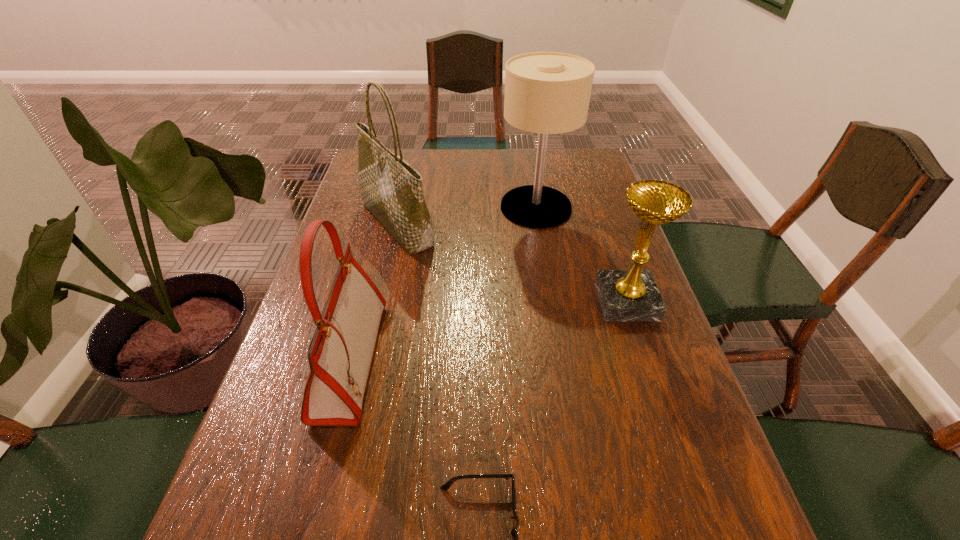
You are a GUI agent. You are given a task and a screenshot of the screen. Output one action in this format:
    pyautogui.click(x=<x>, y=<y>)
    Task: Click on the vacant space that is in between the award and the fourth object from left to right
    The height and width of the screenshot is (540, 960).
    Given the screenshot: What is the action you would take?
    pyautogui.click(x=581, y=254)

Find the location of a particular element. The height and width of the screenshot is (540, 960). empty space that is in between the rightmost object and the shopping bag is located at coordinates (512, 264).

Where is `vacant space in between the table lamp and the second shortest object`? The width and height of the screenshot is (960, 540). vacant space in between the table lamp and the second shortest object is located at coordinates (581, 254).

I want to click on empty space that is in between the award and the second object from right to left, so (x=581, y=254).

At what (x,y) coordinates should I click in order to perform the action: click on vacant region between the handbag and the fourth object from left to right. Please return your answer as a coordinate pair (x, y). Looking at the image, I should click on (444, 284).

Where is `vacant space that is in between the fourth object from left to right and the handbag`? The height and width of the screenshot is (540, 960). vacant space that is in between the fourth object from left to right and the handbag is located at coordinates (444, 284).

Identify the location of object that is the fourth closest to the sunglasses. The height and width of the screenshot is (540, 960). (545, 92).

Select which object is the closest to the handbag. Please provide its 2D coordinates. Your answer should be formatted as a tuple, i.e. [(x, y)], where the tuple contains the x and y coordinates of a point satisfying the conditions above.

[(391, 189)]

Where is `free spot that satisfies the following two spatial constraints: 1. on the back side of the handbag; 2. on the left side of the table lamp`? free spot that satisfies the following two spatial constraints: 1. on the back side of the handbag; 2. on the left side of the table lamp is located at coordinates (391, 207).

Find the location of a particular element. The height and width of the screenshot is (540, 960). free space that satisfies the following two spatial constraints: 1. on the back side of the table lamp; 2. on the right side of the shopping bag is located at coordinates (401, 207).